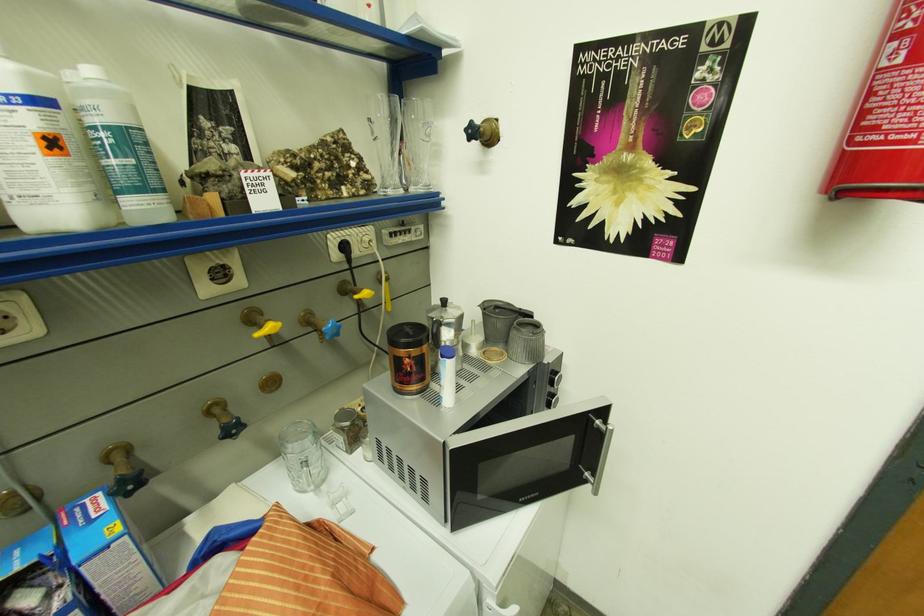
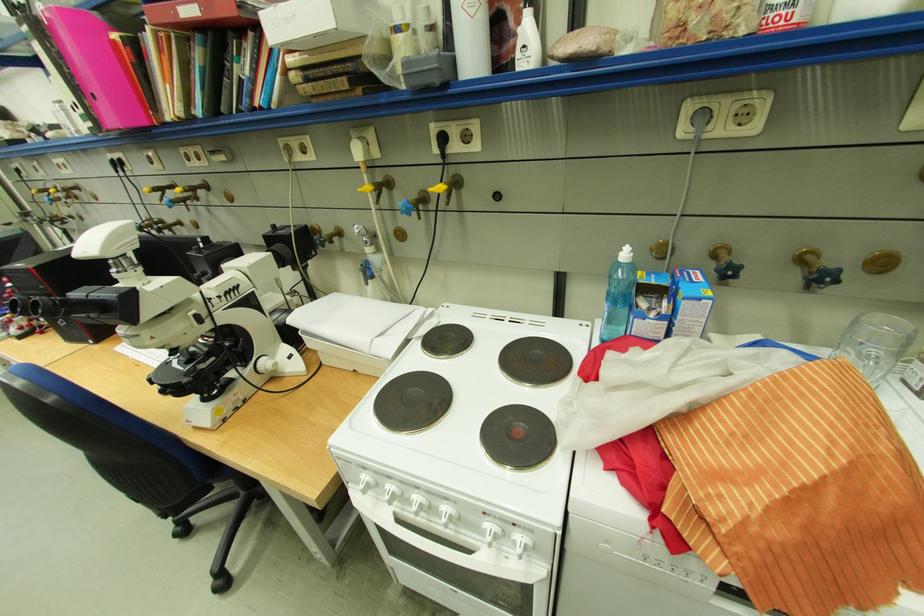
The first image is from the beginning of the video and the second image is from the end. How did the camera likely rotate when shooting the video?

Result: The camera rotated toward left-down.